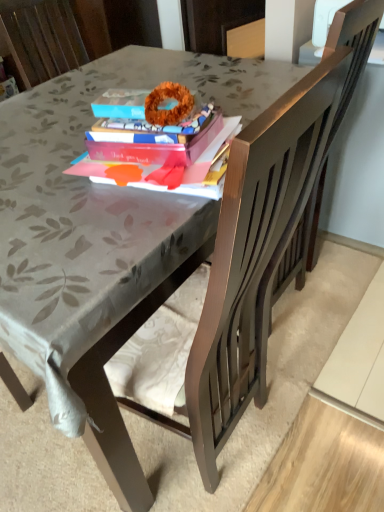
Question: From a real-world perspective, is dark brown wood swivel chair at right on matte pink book at center?

Choices:
 (A) yes
 (B) no

Answer: (B)

Question: From a real-world perspective, is dark brown wood swivel chair at right below matte pink book at center?

Choices:
 (A) yes
 (B) no

Answer: (A)

Question: Could you tell me if dark brown wood swivel chair at right is facing matte pink book at center?

Choices:
 (A) yes
 (B) no

Answer: (B)

Question: Is dark brown wood swivel chair at right surrounding matte pink book at center?

Choices:
 (A) yes
 (B) no

Answer: (B)

Question: Can you confirm if dark brown wood swivel chair at right is smaller than matte pink book at center?

Choices:
 (A) no
 (B) yes

Answer: (A)

Question: Is dark brown wood swivel chair at right taller than matte pink book at center?

Choices:
 (A) no
 (B) yes

Answer: (B)

Question: Is dark brown wood swivel chair at right a part of matte pink book at center?

Choices:
 (A) yes
 (B) no

Answer: (B)

Question: Is matte pink book at center further to camera compared to dark brown wood swivel chair at right?

Choices:
 (A) yes
 (B) no

Answer: (B)

Question: Is matte pink book at center bigger than dark brown wood swivel chair at right?

Choices:
 (A) yes
 (B) no

Answer: (B)

Question: Is matte pink book at center shorter than dark brown wood swivel chair at right?

Choices:
 (A) no
 (B) yes

Answer: (B)

Question: Are matte pink book at center and dark brown wood swivel chair at right far apart?

Choices:
 (A) no
 (B) yes

Answer: (A)

Question: From the image's perspective, is matte pink book at center located beneath dark brown wood swivel chair at right?

Choices:
 (A) yes
 (B) no

Answer: (A)

Question: Looking at their shapes, would you say dark brown wood swivel chair at right is wider or thinner than matte pink book at center?

Choices:
 (A) wide
 (B) thin

Answer: (A)